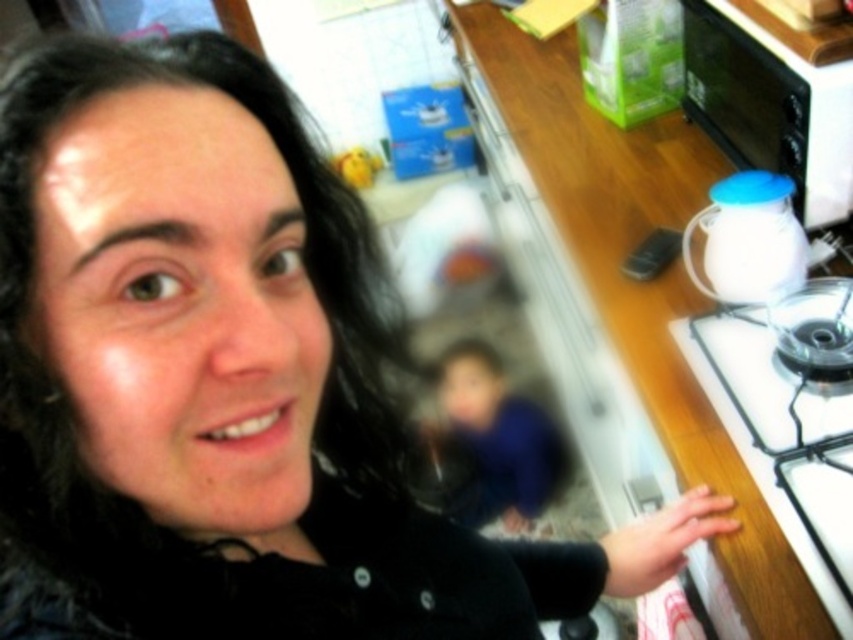
Question: Which point is farther to the camera?

Choices:
 (A) white glossy gas stove at right
 (B) wooden at upper right

Answer: (B)

Question: Which point is closer to the camera?

Choices:
 (A) white glossy gas stove at right
 (B) blue fabric at center
 (C) wooden at upper right
 (D) white glossy oven at upper right

Answer: (A)

Question: Which of the following is the closest to the observer?

Choices:
 (A) (814, 84)
 (B) (660, 397)
 (C) (781, 477)
 (D) (521, 492)

Answer: (C)

Question: In this image, where is wooden at upper right located relative to white glossy oven at upper right?

Choices:
 (A) above
 (B) below

Answer: (B)

Question: From the image, what is the correct spatial relationship of wooden at upper right in relation to white glossy gas stove at right?

Choices:
 (A) left
 (B) right

Answer: (A)

Question: Is wooden at upper right behind white glossy oven at upper right?

Choices:
 (A) no
 (B) yes

Answer: (A)